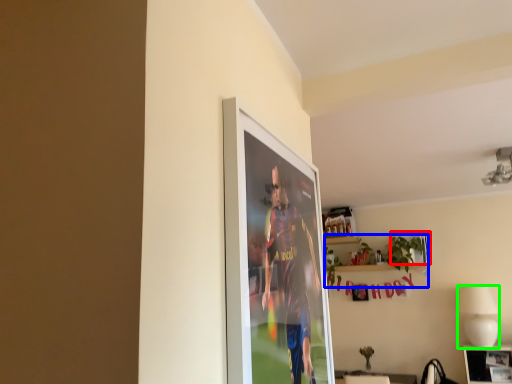
Question: Which is nearer to the picture frame (highlighted by a red box)? houseplant (highlighted by a blue box) or lamp (highlighted by a green box).

Choices:
 (A) houseplant
 (B) lamp

Answer: (A)